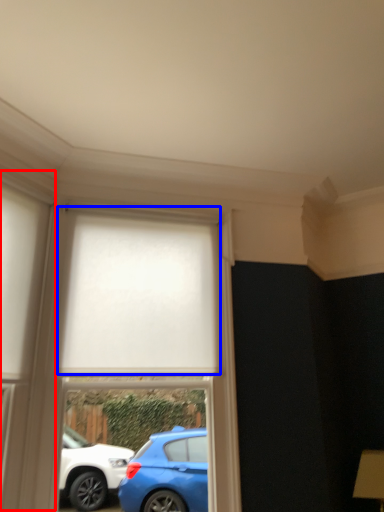
Question: Which object appears farthest to the camera in this image, glass door (highlighted by a red box) or curtain (highlighted by a blue box)?

Choices:
 (A) glass door
 (B) curtain

Answer: (B)